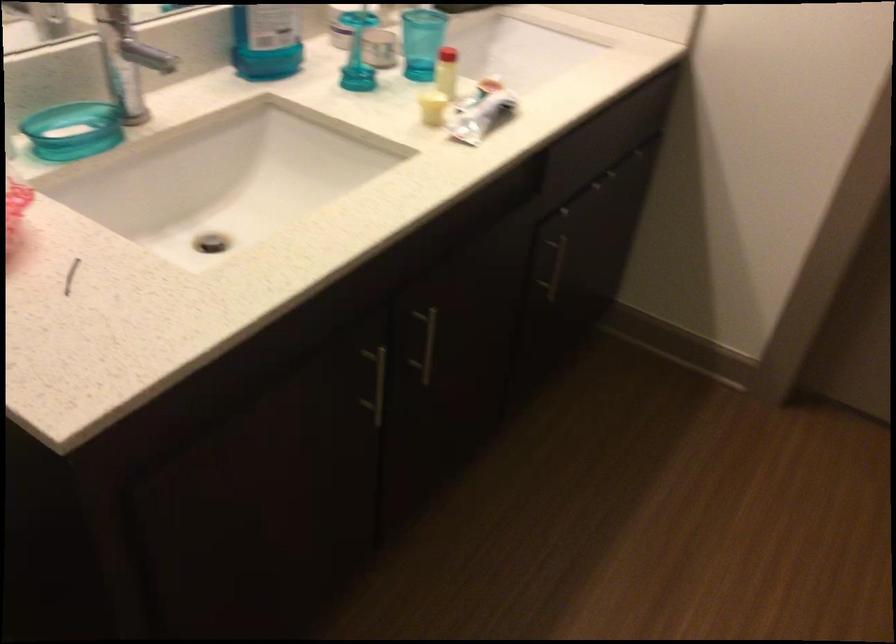
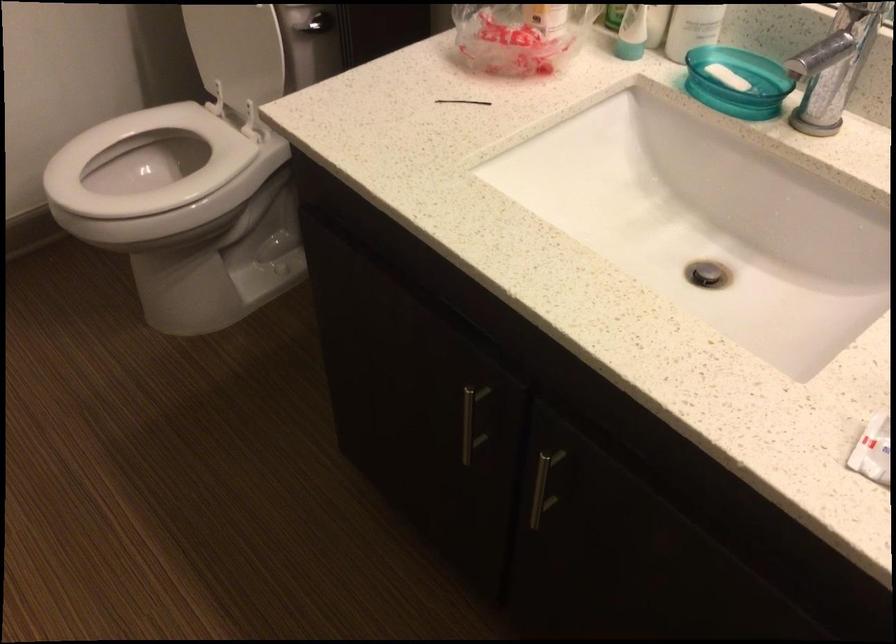
From the picture: First-person continuous shooting, in which direction is the camera rotating?

The rotation direction of the camera is left-down.